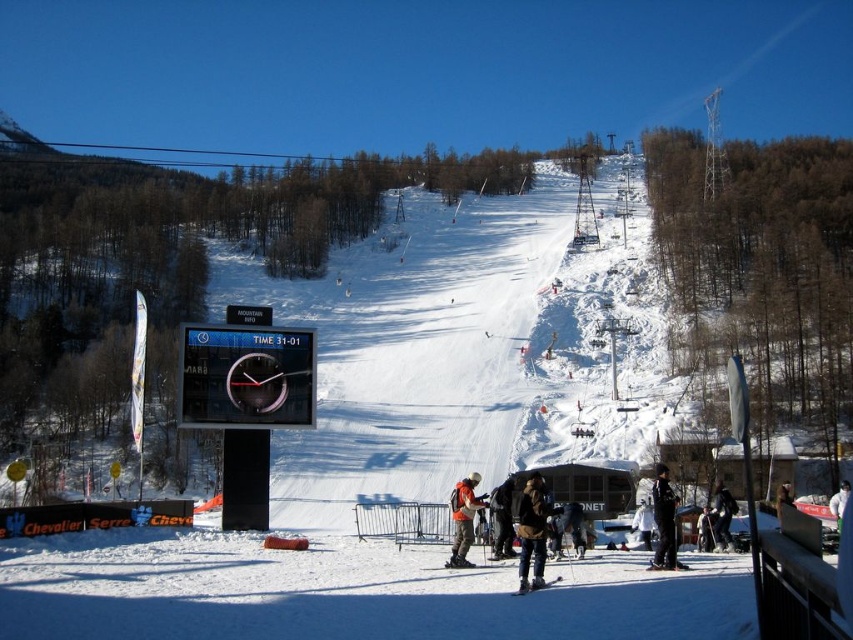
Question: Is dark gray ski pants at center above matte black ski at lower center?

Choices:
 (A) no
 (B) yes

Answer: (A)

Question: Which point is closer to the camera?

Choices:
 (A) (648, 525)
 (B) (463, 492)
 (C) (717, 532)
 (D) (520, 580)

Answer: (D)

Question: Can you confirm if dark brown leather jacket at lower center is positioned below dark gray ski pants at center?

Choices:
 (A) yes
 (B) no

Answer: (B)

Question: Is the position of orange fabric jacket at center more distant than that of black matte snowboarder at center?

Choices:
 (A) no
 (B) yes

Answer: (A)

Question: Which object is closer to the camera taking this photo?

Choices:
 (A) dark brown leather jacket at lower center
 (B) white matte ski at center
 (C) dark gray jacket at lower right

Answer: (A)

Question: Which point is farther to the camera?

Choices:
 (A) dark brown leather jacket at lower center
 (B) white matte snowboarder at center
 (C) black matte ski at lower center

Answer: (B)